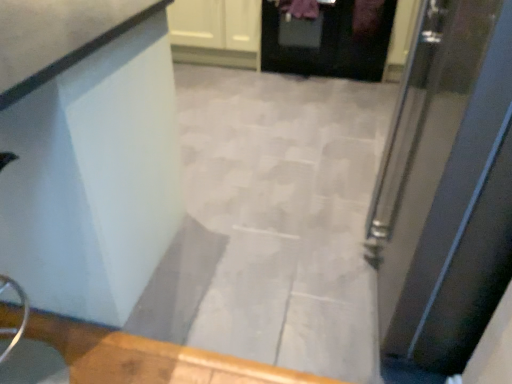
Describe the element at coordinates (325, 43) in the screenshot. I see `black glossy door at upper center, the 2th door from the bottom` at that location.

This screenshot has width=512, height=384. In order to click on white glossy counter at upper left in this screenshot , I will do `click(93, 177)`.

This screenshot has width=512, height=384. Identify the location of black glossy door at upper center, the 2th door from the bottom. (325, 43).

Considering the relative positions of white glossy cabinet at upper center and white glossy counter at upper left in the image provided, is white glossy cabinet at upper center in front of white glossy counter at upper left?

No, it is not.

How different are the orientations of white glossy cabinet at upper center and white glossy counter at upper left in degrees?

The facing directions of white glossy cabinet at upper center and white glossy counter at upper left are 180 degrees apart.

Does white glossy cabinet at upper center turn towards white glossy counter at upper left?

Yes, white glossy cabinet at upper center is turned towards white glossy counter at upper left.

Which of these two, white glossy cabinet at upper center or white glossy counter at upper left, stands shorter?

With less height is white glossy cabinet at upper center.

In terms of size, does white glossy counter at upper left appear bigger or smaller than white glossy cabinet at upper center?

white glossy counter at upper left is bigger than white glossy cabinet at upper center.

From the image's perspective, is white glossy counter at upper left located above or below white glossy cabinet at upper center?

From the image's perspective, white glossy counter at upper left appears below white glossy cabinet at upper center.

Is white glossy counter at upper left wider or thinner than white glossy cabinet at upper center?

white glossy counter at upper left is wider than white glossy cabinet at upper center.

Which is more to the right, white glossy counter at upper left or white glossy cabinet at upper center?

From the viewer's perspective, white glossy cabinet at upper center appears more on the right side.

How many degrees apart are the facing directions of black glossy door at upper center, which appears as the first door when viewed from the top, and metallic silver door at right, marked as the second door in a top-to-bottom arrangement?

black glossy door at upper center, which appears as the first door when viewed from the top, and metallic silver door at right, marked as the second door in a top-to-bottom arrangement, are facing 88.7 degrees away from each other.

Is black glossy door at upper center, the 2th door from the bottom, placed right next to metallic silver door at right, the second door when ordered from back to front?

black glossy door at upper center, the 2th door from the bottom, is not next to metallic silver door at right, the second door when ordered from back to front, and they're not touching.

Is black glossy door at upper center, which appears as the first door when viewed from the top, taller than metallic silver door at right, the second door when ordered from back to front?

Incorrect, the height of black glossy door at upper center, which appears as the first door when viewed from the top, is not larger of that of metallic silver door at right, the second door when ordered from back to front.

From a real-world perspective, between black glossy door at upper center, the 2th door from the bottom, and metallic silver door at right, which is the 1th door from front to back, who is vertically lower?

black glossy door at upper center, the 2th door from the bottom, is physically lower.

Is metallic silver door at right, marked as the second door in a top-to-bottom arrangement, facing away from black glossy door at upper center, which appears as the first door when viewed from the top?

metallic silver door at right, marked as the second door in a top-to-bottom arrangement, does not have its back to black glossy door at upper center, which appears as the first door when viewed from the top.

Considering the sizes of metallic silver door at right, which is the first door from bottom to top, and black glossy door at upper center, which is counted as the 2th door, starting from the front, in the image, is metallic silver door at right, which is the first door from bottom to top, bigger or smaller than black glossy door at upper center, which is counted as the 2th door, starting from the front,?

In the image, metallic silver door at right, which is the first door from bottom to top, appears to be larger than black glossy door at upper center, which is counted as the 2th door, starting from the front.

Are metallic silver door at right, the second door when ordered from back to front, and black glossy door at upper center, the 2th door from the bottom, making contact?

metallic silver door at right, the second door when ordered from back to front, and black glossy door at upper center, the 2th door from the bottom, are not in contact.

From a real-world perspective, between metallic silver door at right, which is the 1th door from front to back, and white glossy counter at upper left, who is vertically lower?

white glossy counter at upper left, from a real-world perspective.

Considering the relative positions of metallic silver door at right, which is the first door from bottom to top, and white glossy counter at upper left in the image provided, is metallic silver door at right, which is the first door from bottom to top, to the left of white glossy counter at upper left from the viewer's perspective?

Incorrect, metallic silver door at right, which is the first door from bottom to top, is not on the left side of white glossy counter at upper left.

Is metallic silver door at right, which is the first door from bottom to top, closer to the viewer compared to white glossy counter at upper left?

Yes, metallic silver door at right, which is the first door from bottom to top, is in front of white glossy counter at upper left.

From a real-world perspective, between black glossy door at upper center, which is counted as the 2th door, starting from the front, and white glossy counter at upper left, who is vertically lower?

black glossy door at upper center, which is counted as the 2th door, starting from the front, is physically lower.

Is black glossy door at upper center, acting as the first door starting from the back, far away from white glossy counter at upper left?

black glossy door at upper center, acting as the first door starting from the back, is positioned a significant distance from white glossy counter at upper left.

Identify the location of the 1st door counting from the right side of the white glossy counter at upper left. Image resolution: width=512 pixels, height=384 pixels. (325, 43).

Between black glossy door at upper center, acting as the first door starting from the back, and white glossy counter at upper left, which one has larger size?

Bigger between the two is white glossy counter at upper left.

Is black glossy door at upper center, the 2th door from the bottom, smaller than white glossy cabinet at upper center?

No, black glossy door at upper center, the 2th door from the bottom, is not smaller than white glossy cabinet at upper center.

Is point (261, 29) farther from camera compared to point (216, 46)?

No, it is in front of (216, 46).

Is black glossy door at upper center, the 2th door from the bottom, far away from white glossy cabinet at upper center?

Actually, black glossy door at upper center, the 2th door from the bottom, and white glossy cabinet at upper center are a little close together.

Identify the location of counter that is below the white glossy cabinet at upper center (from the image's perspective). (93, 177).

The height and width of the screenshot is (384, 512). I want to click on cabinetry behind the white glossy counter at upper left, so click(216, 32).

In the scene shown: Considering their positions, is white glossy counter at upper left positioned closer to black glossy door at upper center, which appears as the first door when viewed from the top, than metallic silver door at right, marked as the second door in a top-to-bottom arrangement?

Based on the image, metallic silver door at right, marked as the second door in a top-to-bottom arrangement, appears to be nearer to black glossy door at upper center, which appears as the first door when viewed from the top.

Considering their positions, is white glossy cabinet at upper center positioned further to black glossy door at upper center, acting as the first door starting from the back, than white glossy counter at upper left?

white glossy counter at upper left.

In the scene shown: Which object lies further to the anchor point black glossy door at upper center, which appears as the first door when viewed from the top, metallic silver door at right, the second door when ordered from back to front, or white glossy counter at upper left?

white glossy counter at upper left.

Estimate the real-world distances between objects in this image. Which object is further from black glossy door at upper center, acting as the first door starting from the back, white glossy cabinet at upper center or metallic silver door at right, the second door when ordered from back to front?

The object further to black glossy door at upper center, acting as the first door starting from the back, is metallic silver door at right, the second door when ordered from back to front.

From the image, which object appears to be farther from white glossy cabinet at upper center, metallic silver door at right, marked as the second door in a top-to-bottom arrangement, or black glossy door at upper center, the 2th door from the bottom?

metallic silver door at right, marked as the second door in a top-to-bottom arrangement.

When comparing their distances from white glossy cabinet at upper center, does white glossy counter at upper left or black glossy door at upper center, acting as the first door starting from the back, seem further?

white glossy counter at upper left lies further to white glossy cabinet at upper center than the other object.

Which object lies nearer to the anchor point white glossy cabinet at upper center, black glossy door at upper center, which is counted as the 2th door, starting from the front, or metallic silver door at right, which is the 1th door from front to back?

black glossy door at upper center, which is counted as the 2th door, starting from the front, is closer to white glossy cabinet at upper center.

Considering their positions, is white glossy cabinet at upper center positioned closer to metallic silver door at right, which is the first door from bottom to top, than black glossy door at upper center, which is counted as the 2th door, starting from the front?

black glossy door at upper center, which is counted as the 2th door, starting from the front, is closer to metallic silver door at right, which is the first door from bottom to top.

This screenshot has width=512, height=384. I want to click on counter positioned between metallic silver door at right, which is the first door from bottom to top, and white glossy cabinet at upper center from near to far, so click(x=93, y=177).

Locate an element on the screen. The image size is (512, 384). door between metallic silver door at right, marked as the second door in a top-to-bottom arrangement, and white glossy cabinet at upper center in the front-back direction is located at coordinates (325, 43).

The width and height of the screenshot is (512, 384). Identify the location of counter between metallic silver door at right, marked as the second door in a top-to-bottom arrangement, and black glossy door at upper center, which appears as the first door when viewed from the top, in the front-back direction. (93, 177).

This screenshot has width=512, height=384. I want to click on door between white glossy counter at upper left and white glossy cabinet at upper center from front to back, so (325, 43).